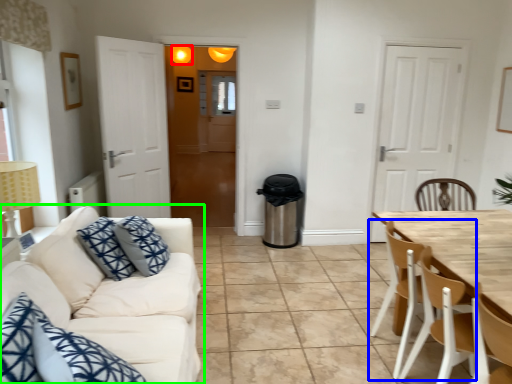
Question: Considering the real-world distances, which object is farthest from light fixture (highlighted by a red box)? chair (highlighted by a blue box) or studio couch (highlighted by a green box)?

Choices:
 (A) chair
 (B) studio couch

Answer: (A)